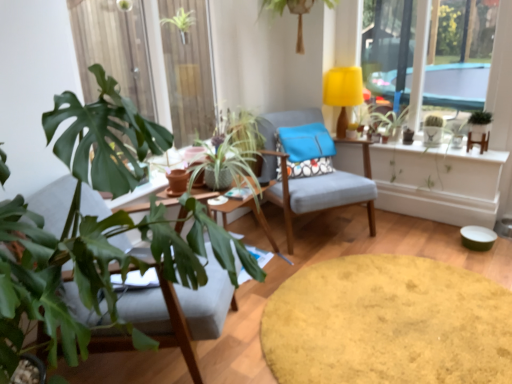
The height and width of the screenshot is (384, 512). What are the coordinates of `free location in front of green matte cactus at upper right, which ranks as the second houseplant in right-to-left order` in the screenshot? It's located at (448, 145).